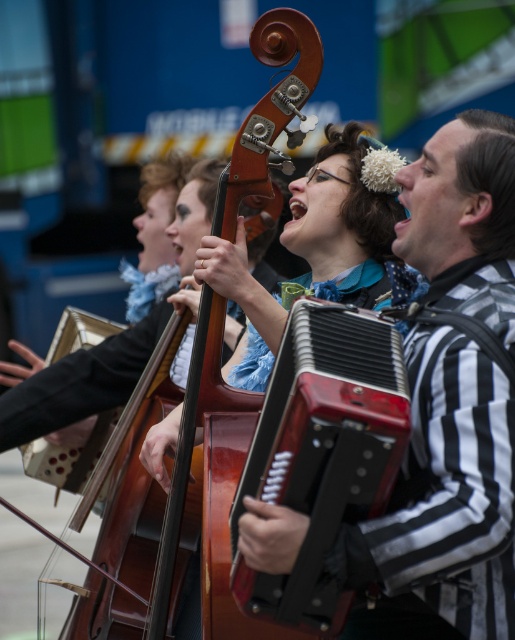
Question: Which point is closer to the camera?

Choices:
 (A) (150, 449)
 (B) (160, 582)

Answer: (B)

Question: Does matte brown cello at center lie behind wooden violin at center?

Choices:
 (A) yes
 (B) no

Answer: (A)

Question: Is matte brown cello at center positioned at the back of wooden violin at center?

Choices:
 (A) yes
 (B) no

Answer: (A)

Question: Is red leather accordion at center thinner than wooden violin at center?

Choices:
 (A) no
 (B) yes

Answer: (B)

Question: Which of the following is the closest to the observer?

Choices:
 (A) (285, 56)
 (B) (324, 440)
 (C) (348, 163)

Answer: (B)

Question: Which object is closer to the camera taking this photo?

Choices:
 (A) matte brown cello at center
 (B) red leather accordion at center
 (C) wooden violin at center

Answer: (B)